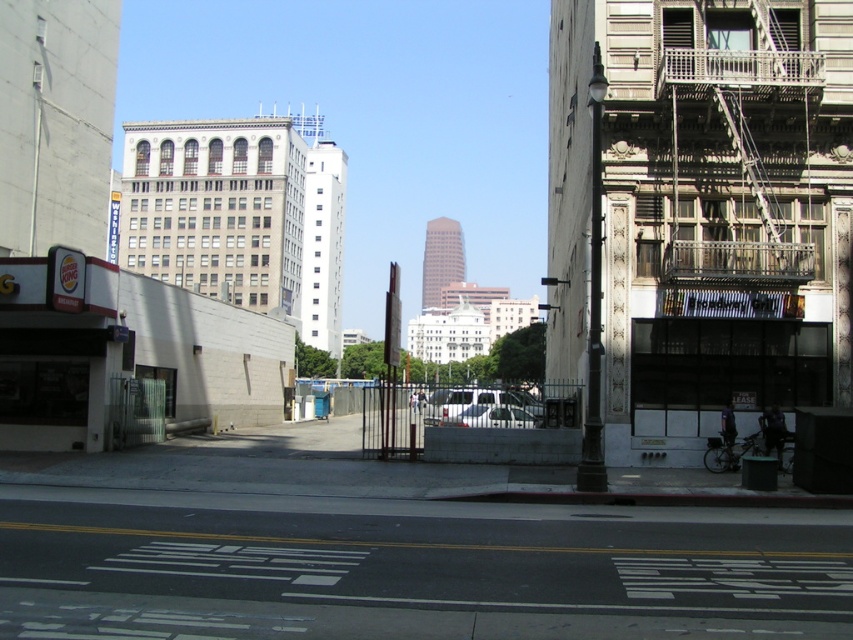
Between silver metallic van at center and silver metallic car at center, which one is positioned higher?

silver metallic van at center

Based on the photo, who is lower down, silver metallic van at center or silver metallic car at center?

silver metallic car at center is lower down.

The height and width of the screenshot is (640, 853). I want to click on silver metallic van at center, so tap(480, 408).

Identify the location of silver metallic van at center. (480, 408).

Does point (691, 458) come closer to viewer compared to point (477, 390)?

Yes.

Does metallic silver fire escape at right have a smaller size compared to silver metallic van at center?

No.

Is point (660, 230) closer to viewer compared to point (444, 397)?

No, it is behind (444, 397).

Locate an element on the screen. The width and height of the screenshot is (853, 640). metallic silver fire escape at right is located at coordinates (703, 212).

Which is more to the right, metallic silver fire escape at right or silver metallic car at center?

metallic silver fire escape at right is more to the right.

Is point (730, 113) less distant than point (531, 428)?

That is True.

Does point (763, 228) lie in front of point (485, 426)?

That is False.

The width and height of the screenshot is (853, 640). Find the location of `metallic silver fire escape at right`. metallic silver fire escape at right is located at coordinates (703, 212).